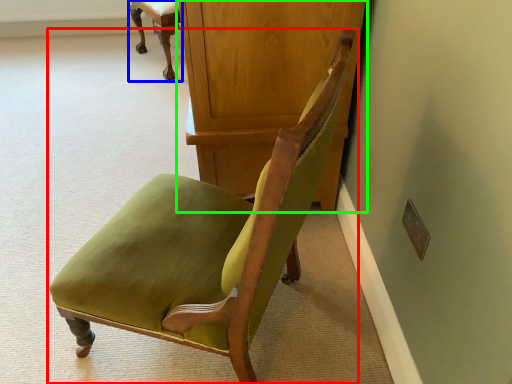
Question: Which object is positioned farthest from chair (highlighted by a red box)? Select from chair (highlighted by a blue box) and dresser (highlighted by a green box).

Choices:
 (A) chair
 (B) dresser

Answer: (A)